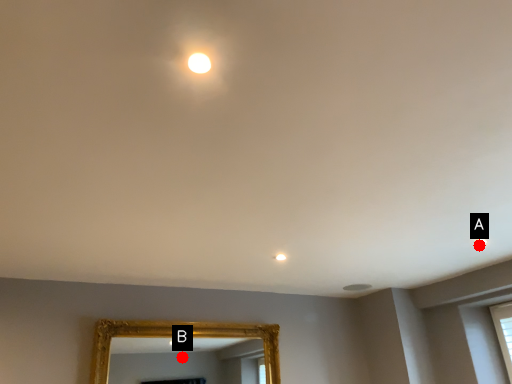
Question: Two points are circled on the image, labeled by A and B beside each circle. Which point is closer to the camera?

Choices:
 (A) A is closer
 (B) B is closer

Answer: (A)